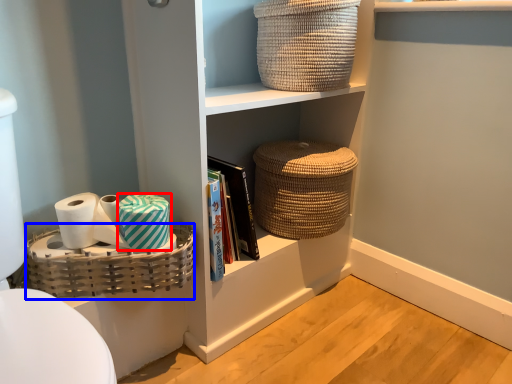
Question: Which of the following is the closest to the observer, material (highlighted by a red box) or basket (highlighted by a blue box)?

Choices:
 (A) material
 (B) basket

Answer: (B)